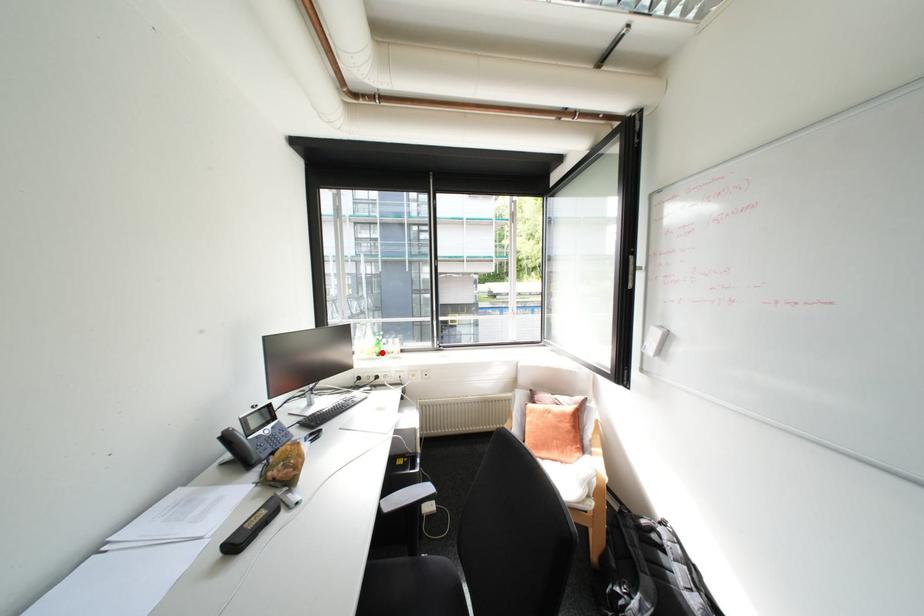
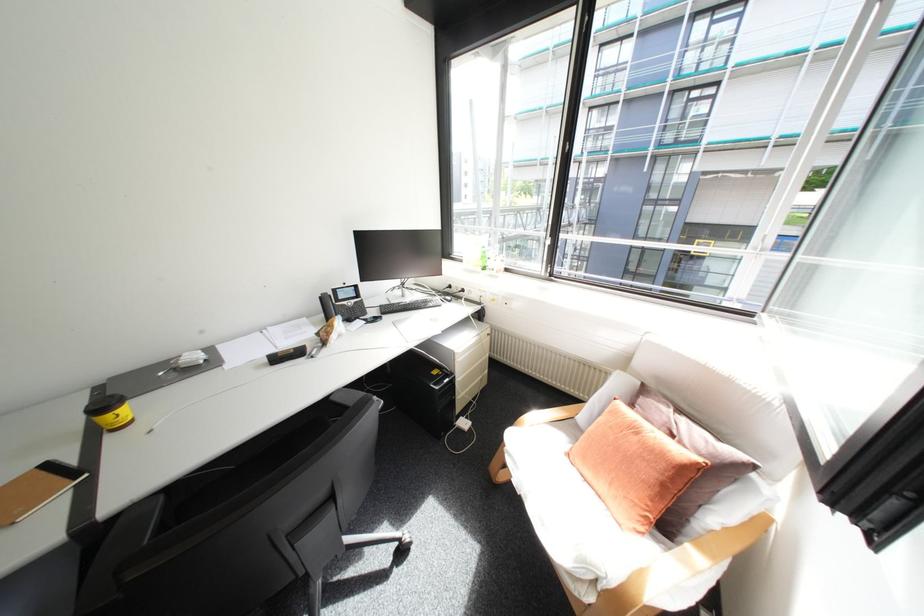
Find the pixel in the second image that matches the highlighted location in the first image.

(487, 265)